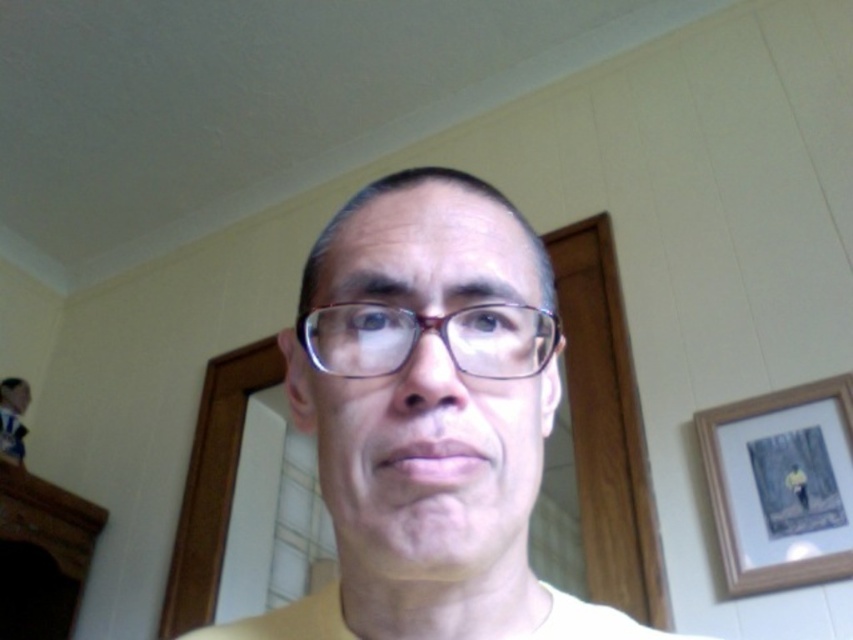
You are an interior designer assessing the layout of a room. You notice the wooden framed artwork at right and the matte purple glasses at center. Based on their positions, which object is closer to the viewer?

The matte purple glasses at center are closer to the viewer because the wooden framed artwork at right is positioned under them, indicating it is behind.

You are a photographer adjusting the camera focus. You notice the matte yellow shirt at center and the matte purple glasses at center in your viewfinder. Which object should you focus on first to ensure both are in focus?

The matte purple glasses at center is behind the matte yellow shirt at center, so you should focus on the matte yellow shirt at center first to ensure both are in focus.

You are standing in front of the wooden framed doorway and want to place a new picture frame exactly where the wooden framed artwork at right is currently located. What are the coordinates you should aim for?

The wooden framed artwork at right is located at coordinates (779,484), so you should aim for those coordinates to place the new picture frame.